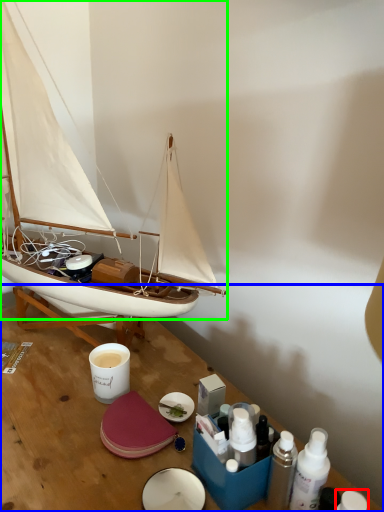
Question: Considering the real-world distances, which object is farthest from toiletry (highlighted by a red box)? table (highlighted by a blue box) or boat (highlighted by a green box)?

Choices:
 (A) table
 (B) boat

Answer: (B)